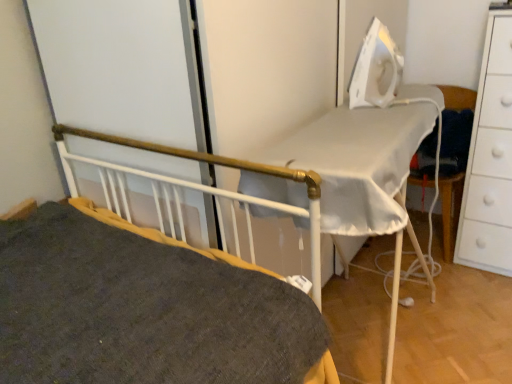
Question: Is white plastic iron at upper right oriented away from white matte chest of drawers at right?

Choices:
 (A) no
 (B) yes

Answer: (A)

Question: Does white plastic iron at upper right have a lesser height compared to white matte chest of drawers at right?

Choices:
 (A) yes
 (B) no

Answer: (A)

Question: Is white plastic iron at upper right smaller than white matte chest of drawers at right?

Choices:
 (A) yes
 (B) no

Answer: (A)

Question: Does white plastic iron at upper right have a lesser width compared to white matte chest of drawers at right?

Choices:
 (A) yes
 (B) no

Answer: (A)

Question: From a real-world perspective, is white plastic iron at upper right below white matte chest of drawers at right?

Choices:
 (A) yes
 (B) no

Answer: (B)

Question: From the image's perspective, would you say white plastic iron at upper right is positioned over white matte chest of drawers at right?

Choices:
 (A) yes
 (B) no

Answer: (A)

Question: Can you confirm if white plastic iron at upper right is bigger than white fabric chair at right?

Choices:
 (A) yes
 (B) no

Answer: (B)

Question: Is white plastic iron at upper right aimed at white fabric chair at right?

Choices:
 (A) yes
 (B) no

Answer: (B)

Question: Can you confirm if white plastic iron at upper right is wider than white fabric chair at right?

Choices:
 (A) yes
 (B) no

Answer: (B)

Question: Is white plastic iron at upper right directly adjacent to white fabric chair at right?

Choices:
 (A) no
 (B) yes

Answer: (A)

Question: From the image's perspective, is white plastic iron at upper right above white fabric chair at right?

Choices:
 (A) no
 (B) yes

Answer: (B)

Question: Is white fabric chair at right located within white plastic iron at upper right?

Choices:
 (A) no
 (B) yes

Answer: (A)

Question: From a real-world perspective, does dark gray fabric bed at center sit lower than white plastic iron at upper right?

Choices:
 (A) no
 (B) yes

Answer: (B)